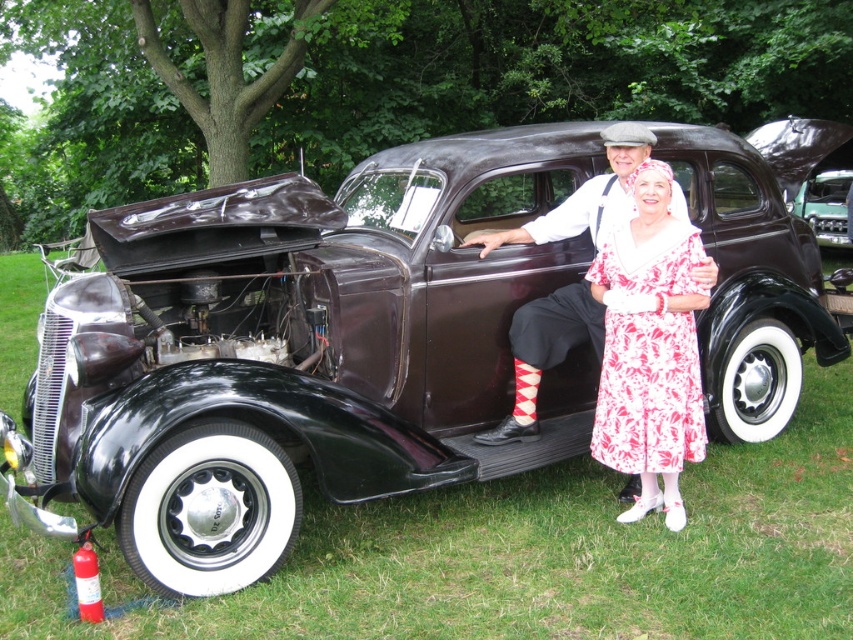
Question: Is floral cotton dress at center below printed cotton dress at center?

Choices:
 (A) yes
 (B) no

Answer: (A)

Question: Can you confirm if floral cotton dress at center is positioned to the left of printed cotton dress at center?

Choices:
 (A) no
 (B) yes

Answer: (A)

Question: Which object appears closest to the camera in this image?

Choices:
 (A) printed cotton dress at center
 (B) floral cotton dress at center

Answer: (B)

Question: Is floral cotton dress at center below printed cotton dress at center?

Choices:
 (A) yes
 (B) no

Answer: (A)